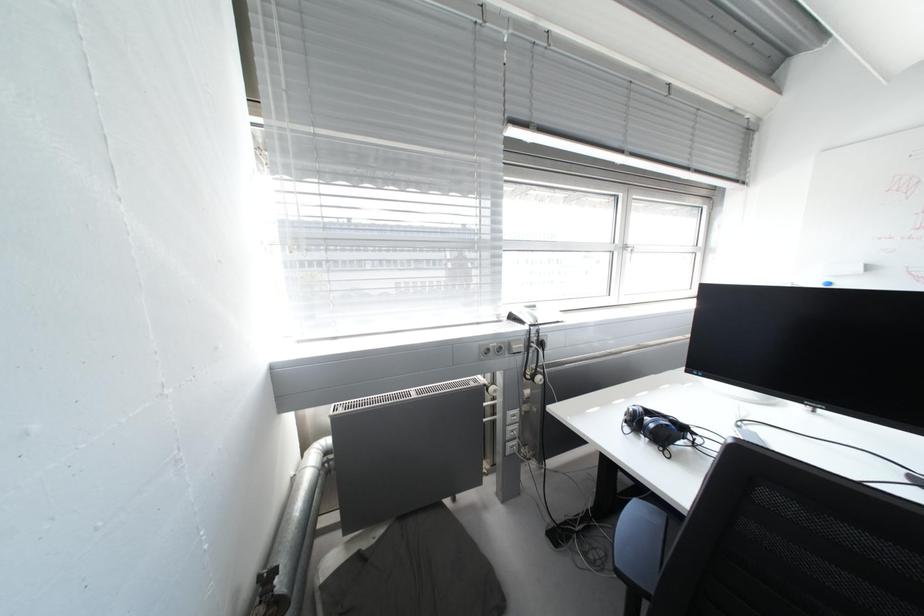
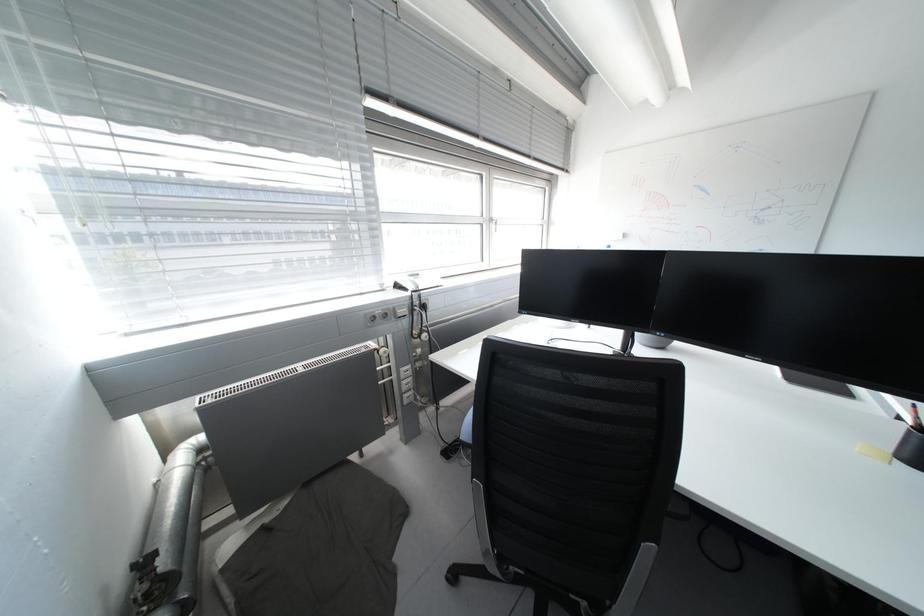
Question: The camera is either moving clockwise (left) or counter-clockwise (right) around the object. The first image is from the beginning of the video and the second image is from the end. Is the camera moving left or right when shooting the video?

Choices:
 (A) Left
 (B) Right

Answer: (A)